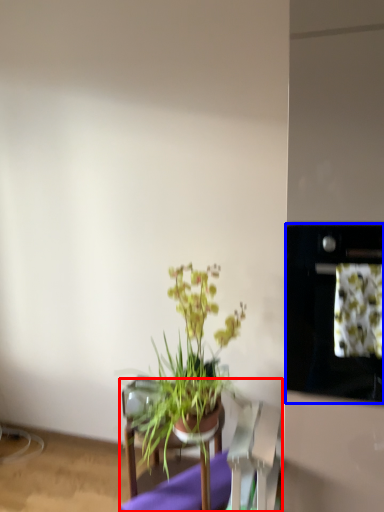
Question: Which object appears closest to the camera in this image, furniture (highlighted by a red box) or oven (highlighted by a blue box)?

Choices:
 (A) furniture
 (B) oven

Answer: (B)